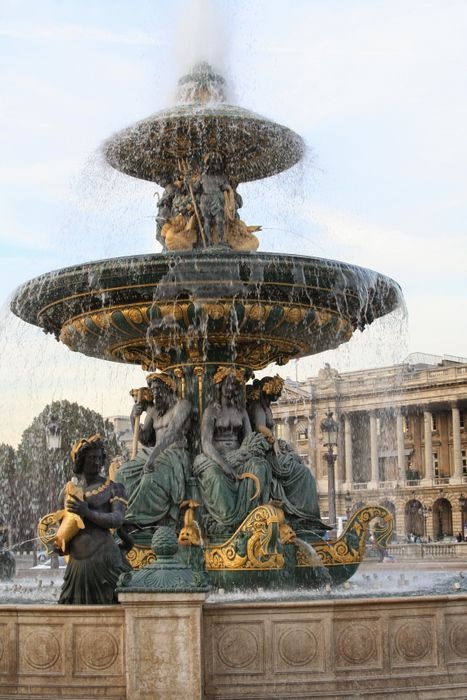
Where is `lanterns`? lanterns is located at coordinates (327, 434), (53, 442).